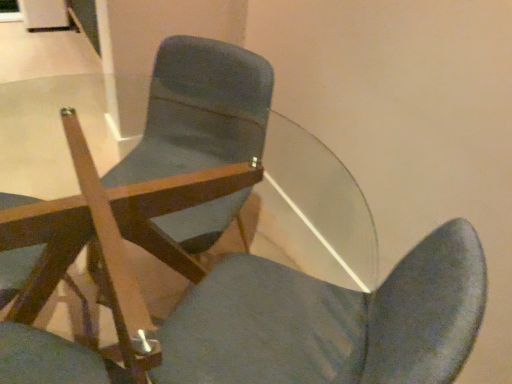
Question: Which direction should I rotate to face matte wood chair at center, which is the 1th chair from right to left, — up or down?

Choices:
 (A) down
 (B) up

Answer: (B)

Question: Considering the relative sizes of matte wood chair at center, the third chair viewed from the left, and wooden chair at center, which appears as the third chair when viewed from the right, in the image provided, is matte wood chair at center, the third chair viewed from the left, bigger than wooden chair at center, which appears as the third chair when viewed from the right,?

Choices:
 (A) no
 (B) yes

Answer: (B)

Question: Would you say matte wood chair at center, the third chair viewed from the left, is outside wooden chair at center, which appears as the third chair when viewed from the right?

Choices:
 (A) no
 (B) yes

Answer: (B)

Question: Is the position of matte wood chair at center, the third chair viewed from the left, less distant than that of wooden chair at center, which is the 1th chair from left to right?

Choices:
 (A) no
 (B) yes

Answer: (A)

Question: From the image's perspective, does matte wood chair at center, which is the 1th chair from right to left, appear lower than wooden chair at center, which is the 1th chair from left to right?

Choices:
 (A) no
 (B) yes

Answer: (A)

Question: Considering the relative sizes of matte wood chair at center, which is the 1th chair from right to left, and wooden chair at center, which is the 1th chair from left to right, in the image provided, is matte wood chair at center, which is the 1th chair from right to left, smaller than wooden chair at center, which is the 1th chair from left to right,?

Choices:
 (A) no
 (B) yes

Answer: (A)

Question: Is matte wood chair at center, which is the 1th chair from right to left, facing away from wooden chair at center, which is the 1th chair from left to right?

Choices:
 (A) yes
 (B) no

Answer: (B)

Question: From a real-world perspective, is matte wood chair at center, arranged as the second chair when viewed from the left, physically above matte wood chair at center, the third chair viewed from the left?

Choices:
 (A) yes
 (B) no

Answer: (B)

Question: Considering the relative sizes of matte wood chair at center, arranged as the second chair when viewed from the right, and matte wood chair at center, the third chair viewed from the left, in the image provided, is matte wood chair at center, arranged as the second chair when viewed from the right, smaller than matte wood chair at center, the third chair viewed from the left,?

Choices:
 (A) yes
 (B) no

Answer: (B)

Question: From the image's perspective, is matte wood chair at center, arranged as the second chair when viewed from the right, on matte wood chair at center, the third chair viewed from the left?

Choices:
 (A) no
 (B) yes

Answer: (A)

Question: Is matte wood chair at center, arranged as the second chair when viewed from the left, completely or partially outside of matte wood chair at center, which is the 1th chair from right to left?

Choices:
 (A) yes
 (B) no

Answer: (A)

Question: From the image's perspective, would you say matte wood chair at center, arranged as the second chair when viewed from the left, is shown under matte wood chair at center, which is the 1th chair from right to left?

Choices:
 (A) yes
 (B) no

Answer: (A)

Question: Is matte wood chair at center, arranged as the second chair when viewed from the left, further to camera compared to matte wood chair at center, the third chair viewed from the left?

Choices:
 (A) yes
 (B) no

Answer: (B)

Question: Is wooden chair at center, which is the 1th chair from left to right, smaller than matte wood chair at center, arranged as the second chair when viewed from the left?

Choices:
 (A) no
 (B) yes

Answer: (B)